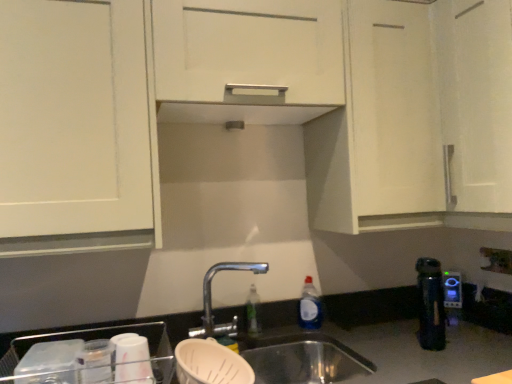
Question: From a real-world perspective, does white matte cabinet at upper center stand above blue plastic kettle at right?

Choices:
 (A) no
 (B) yes

Answer: (B)

Question: Can you confirm if white matte cabinet at upper center is positioned to the right of blue plastic kettle at right?

Choices:
 (A) no
 (B) yes

Answer: (A)

Question: Is white matte cabinet at upper center thinner than blue plastic kettle at right?

Choices:
 (A) yes
 (B) no

Answer: (B)

Question: From a real-world perspective, is white matte cabinet at upper center below blue plastic kettle at right?

Choices:
 (A) yes
 (B) no

Answer: (B)

Question: Is blue plastic kettle at right inside white matte cabinet at upper center?

Choices:
 (A) yes
 (B) no

Answer: (B)

Question: Does white matte cabinet at upper center have a smaller size compared to blue plastic kettle at right?

Choices:
 (A) no
 (B) yes

Answer: (A)

Question: Is white matte cabinet at upper center in contact with white plastic electric outlet at lower right?

Choices:
 (A) no
 (B) yes

Answer: (A)

Question: Considering the relative sizes of white matte cabinet at upper center and white plastic electric outlet at lower right in the image provided, is white matte cabinet at upper center bigger than white plastic electric outlet at lower right?

Choices:
 (A) yes
 (B) no

Answer: (A)

Question: Does white matte cabinet at upper center have a greater height compared to white plastic electric outlet at lower right?

Choices:
 (A) yes
 (B) no

Answer: (A)

Question: Does white matte cabinet at upper center appear on the right side of white plastic electric outlet at lower right?

Choices:
 (A) yes
 (B) no

Answer: (B)

Question: Is white matte cabinet at upper center turned away from white plastic electric outlet at lower right?

Choices:
 (A) no
 (B) yes

Answer: (A)

Question: Is white matte cabinet at upper center closer to the viewer compared to white plastic electric outlet at lower right?

Choices:
 (A) yes
 (B) no

Answer: (A)

Question: Considering the relative sizes of blue plastic bottle at sink and blue plastic kettle at right in the image provided, is blue plastic bottle at sink shorter than blue plastic kettle at right?

Choices:
 (A) no
 (B) yes

Answer: (A)